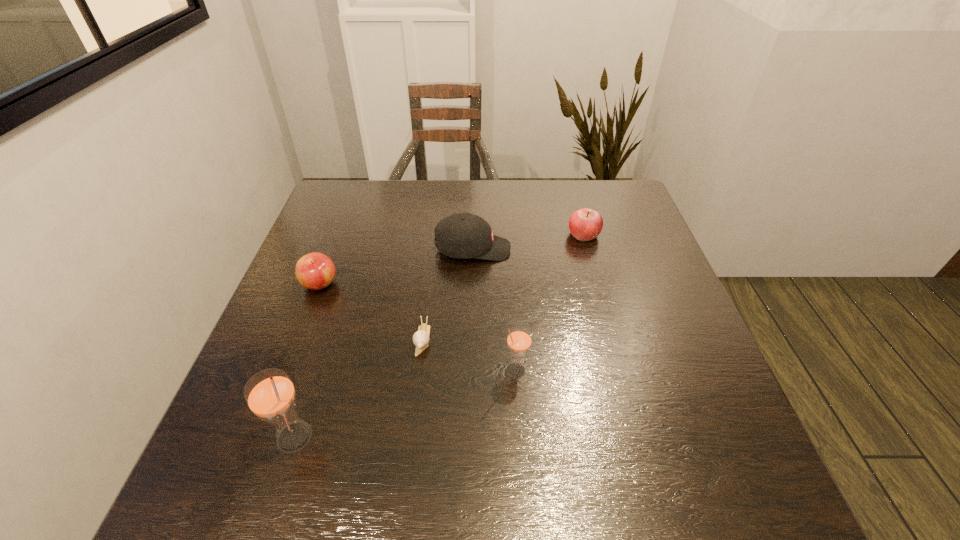
The width and height of the screenshot is (960, 540). Identify the location of object present at the right edge. (585, 224).

This screenshot has height=540, width=960. What are the coordinates of `object present at the near left corner` in the screenshot? It's located at (270, 394).

Locate an element on the screen. free spot at the far edge of the desktop is located at coordinates (533, 197).

Locate an element on the screen. Image resolution: width=960 pixels, height=540 pixels. vacant position at the near edge of the desktop is located at coordinates (343, 443).

In the image, there is a desktop. Find the location of `free space at the left edge`. free space at the left edge is located at coordinates (331, 237).

This screenshot has height=540, width=960. Find the location of `free space at the right edge`. free space at the right edge is located at coordinates [x=672, y=377].

Locate an element on the screen. This screenshot has height=540, width=960. free space at the far left corner is located at coordinates (375, 187).

In the image, there is a desktop. Where is `blank space at the near left corner`? The height and width of the screenshot is (540, 960). blank space at the near left corner is located at coordinates (251, 416).

In the image, there is a desktop. Where is `vacant space at the far right corner`? The image size is (960, 540). vacant space at the far right corner is located at coordinates (608, 218).

Locate an element on the screen. The height and width of the screenshot is (540, 960). free spot between the baseball cap and the escargot is located at coordinates (447, 294).